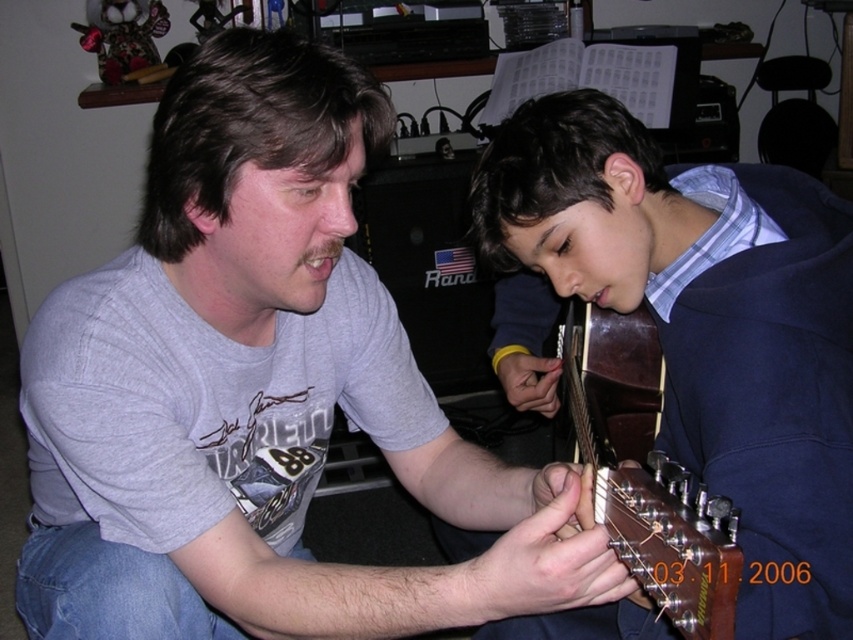
Question: Based on their relative distances, which object is nearer to the gray matte t-shirt at center?

Choices:
 (A) brown glossy guitar at lower center
 (B) dark blue sweater at center

Answer: (B)

Question: Can you confirm if gray matte t-shirt at center is positioned above dark blue sweater at center?

Choices:
 (A) no
 (B) yes

Answer: (A)

Question: Is gray matte t-shirt at center to the left of dark blue sweater at center from the viewer's perspective?

Choices:
 (A) no
 (B) yes

Answer: (B)

Question: Among these objects, which one is nearest to the camera?

Choices:
 (A) brown glossy guitar at lower center
 (B) dark blue sweater at center
 (C) gray matte t-shirt at center

Answer: (C)

Question: Is gray matte t-shirt at center wider than dark blue sweater at center?

Choices:
 (A) no
 (B) yes

Answer: (B)

Question: Which object appears farthest from the camera in this image?

Choices:
 (A) dark blue sweater at center
 (B) gray matte t-shirt at center
 (C) brown glossy guitar at lower center

Answer: (C)